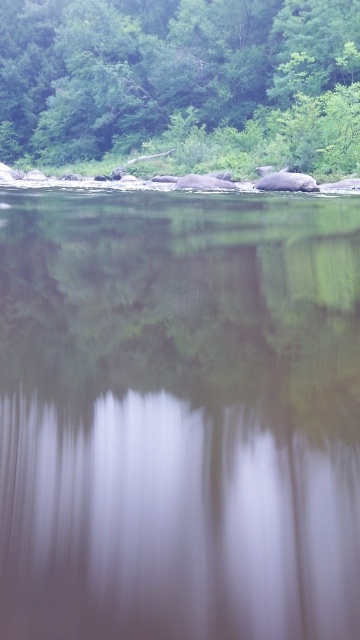
You are a photographer who wants to capture a landscape shot with both the transparent glass lake at center and the green leafy tree at upper center. Based on their sizes in the image, which object should you focus on first to ensure it is in sharp focus?

The green leafy tree at upper center should be focused on first because it occupies more space in the image than the transparent glass lake at center, making it a more prominent subject.

You are a hiker who wants to cross the transparent glass lake at center. You have a 70 meter long rope. Can you use the rope to reach the green leafy tree at upper center from the edge of the lake?

The distance between the transparent glass lake at center and the green leafy tree at upper center is 73.04 meters. Since the rope is only 70 meters long, it is not long enough to reach the green leafy tree at upper center from the edge of the lake.

You are standing at the edge of the transparent glass lake at center and looking up towards the green leafy tree at upper center. Which object is closer to your eyes?

The transparent glass lake at center is closer to your eyes because you are standing at its edge, while the green leafy tree at upper center is positioned above it.